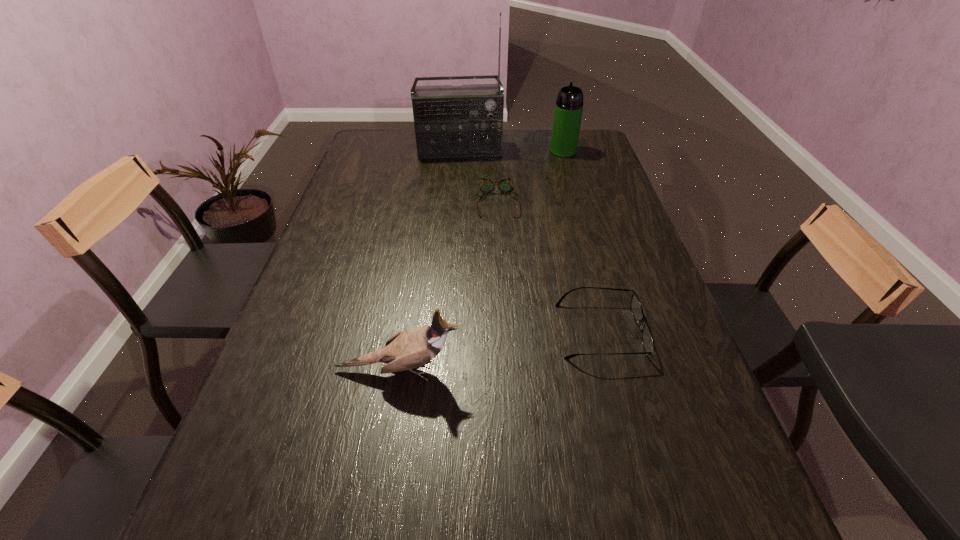
Locate an element on the screen. This screenshot has height=540, width=960. free space on the desktop that is between the third shortest object and the nearer spectacles and is positioned on the front-facing side of the left spectacles is located at coordinates (504, 349).

You are a GUI agent. You are given a task and a screenshot of the screen. Output one action in this format:
    pyautogui.click(x=<x>, y=<y>)
    Task: Click on the free space on the desktop that is between the third tallest object and the right spectacles and is positioned on the front panel of the tallest object
    The width and height of the screenshot is (960, 540).
    Given the screenshot: What is the action you would take?
    click(x=479, y=354)

Where is `vacant space on the desktop that is between the bird and the right spectacles and is positioned from the spout of the second tallest object`? Image resolution: width=960 pixels, height=540 pixels. vacant space on the desktop that is between the bird and the right spectacles and is positioned from the spout of the second tallest object is located at coordinates (513, 348).